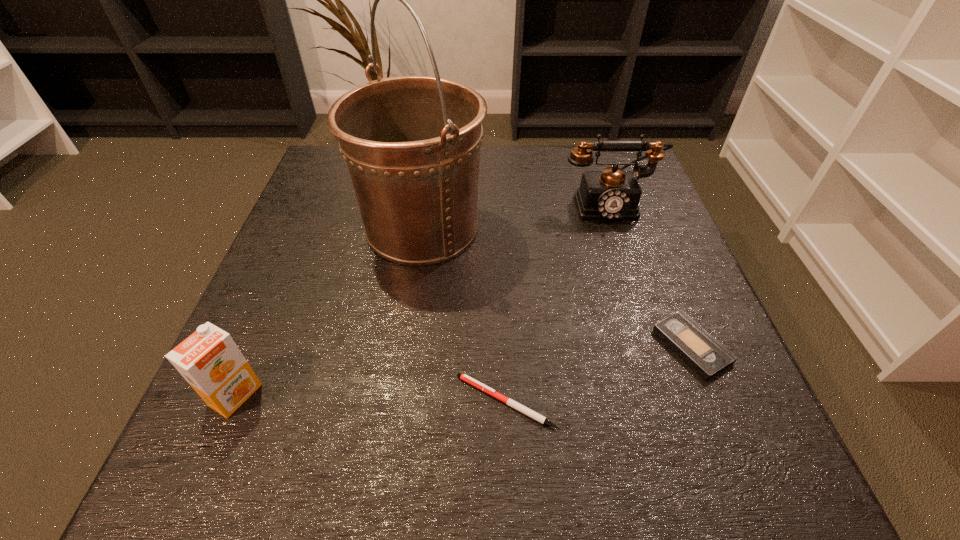
This screenshot has height=540, width=960. In order to click on free region that satisfies the following two spatial constraints: 1. on the front of the fourth shortest object at the rotary dial; 2. on the clicker of the shortest object in this screenshot , I will do `click(674, 402)`.